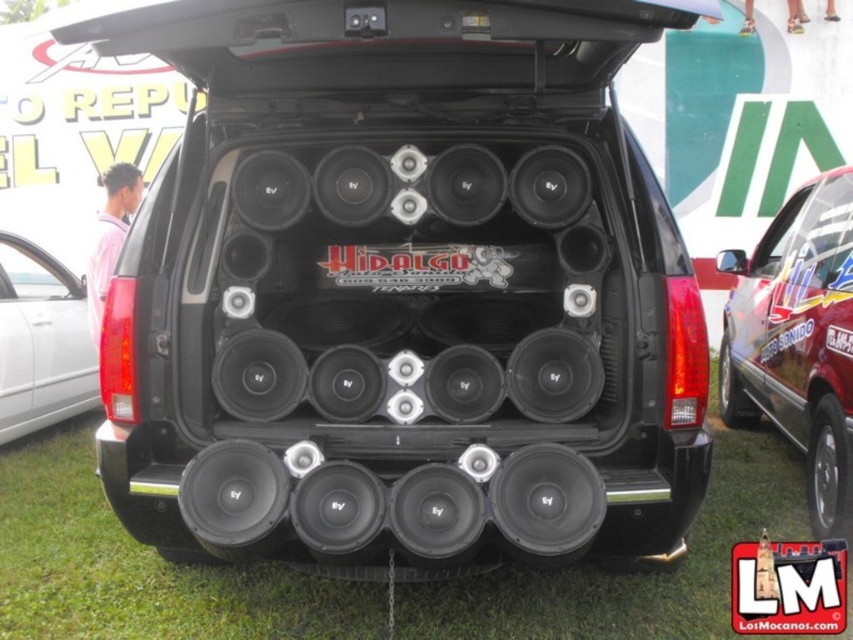
You are a photographer at the car show and want to take a photo of the shiny metallic car at right and the black matte speaker at lower left. From the perspective of someone standing directly in front of the trunk, which object is positioned to the right side?

The shiny metallic car at right is positioned to the right of the black matte speaker at lower left.